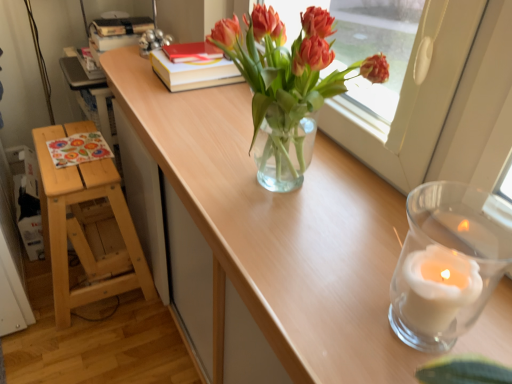
Locate an element on the screen. The height and width of the screenshot is (384, 512). blank space situated above hardcover book at center, marked as the 1th book in a bottom-to-top arrangement (from a real-world perspective) is located at coordinates pyautogui.click(x=198, y=49).